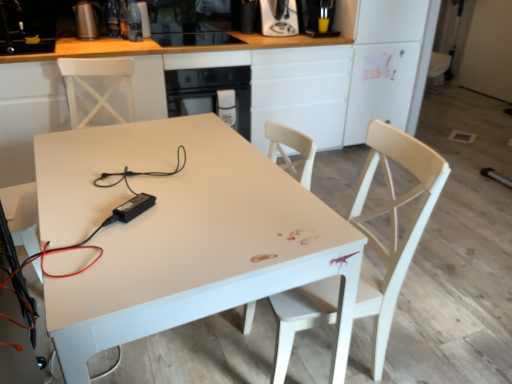
Locate an element on the screen. The height and width of the screenshot is (384, 512). vacant area that lies in front of satin silver coffee machine at upper center, which ranks as the 2th coffee machine in right-to-left order is located at coordinates pos(273,34).